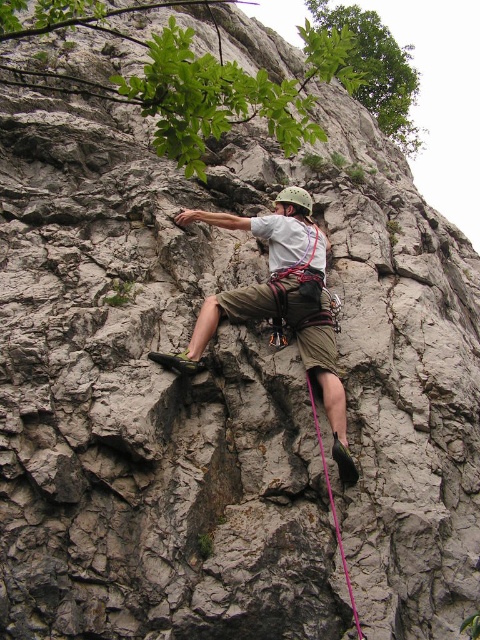
Based on the photo, you are a rock climber assessing your gear. You notice the matte khaki shorts at center and the pink nylon rope at lower center. Which item has a greater width?

The matte khaki shorts at center has a greater width than the pink nylon rope at lower center according to the description.